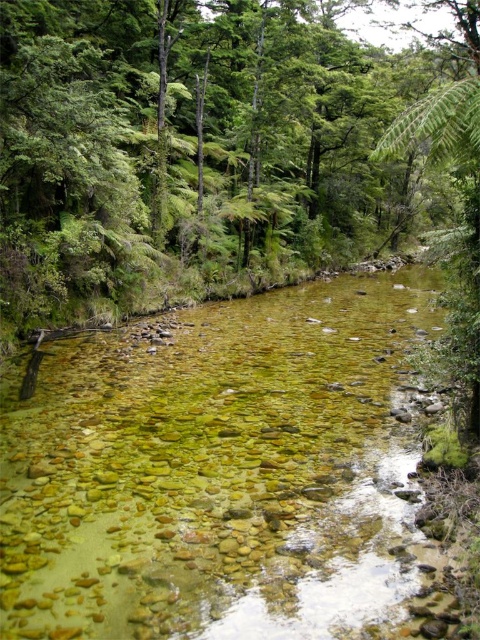
Does translucent rock bed at center have a smaller size compared to green leafy tree at center?

Correct, translucent rock bed at center occupies less space than green leafy tree at center.

Is translucent rock bed at center taller than green leafy tree at center?

No.

Between point (80, 632) and point (0, 58), which one is positioned in front?

Point (80, 632) is in front.

Where is `translucent rock bed at center`? translucent rock bed at center is located at coordinates (215, 468).